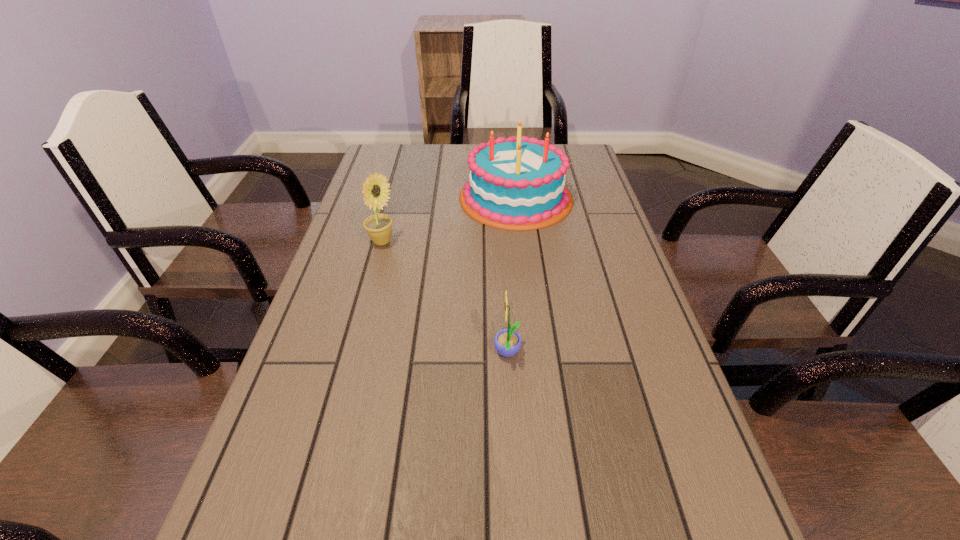
What are the coordinates of `free spot between the nearer sunflower and the farther sunflower` in the screenshot? It's located at (444, 298).

Image resolution: width=960 pixels, height=540 pixels. Identify the location of empty space that is in between the shorter sunflower and the taller sunflower. pyautogui.click(x=444, y=298).

Locate which object ranks second in proximity to the left sunflower. Please provide its 2D coordinates. Your answer should be formatted as a tuple, i.e. [(x, y)], where the tuple contains the x and y coordinates of a point satisfying the conditions above.

[(507, 342)]

Locate which object ranks second in proximity to the birthday cake. Please provide its 2D coordinates. Your answer should be formatted as a tuple, i.e. [(x, y)], where the tuple contains the x and y coordinates of a point satisfying the conditions above.

[(507, 342)]